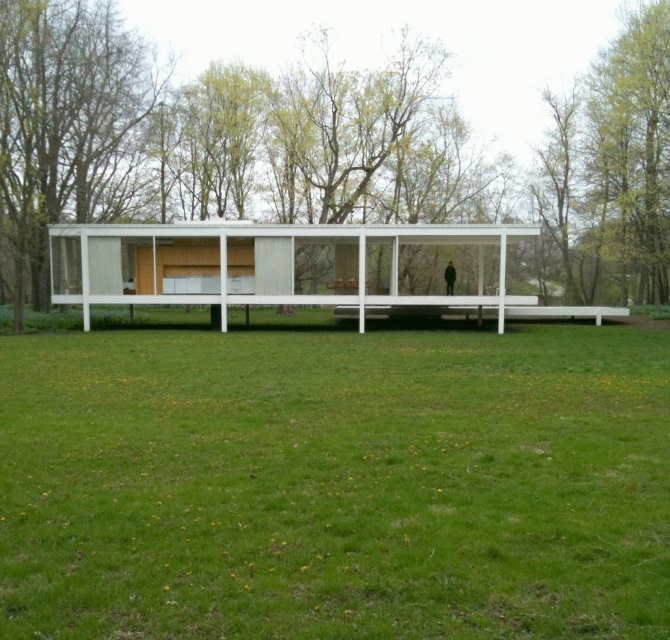
Question: Which of the following is the farthest from the observer?

Choices:
 (A) green leafy tree at center
 (B) green leafy tree at left

Answer: (B)

Question: Is green grass at lower center smaller than green leafy tree at left?

Choices:
 (A) no
 (B) yes

Answer: (B)

Question: Which of the following is the closest to the observer?

Choices:
 (A) (304, 464)
 (B) (31, 161)

Answer: (A)

Question: Does green leafy tree at center have a lesser width compared to green leafy tree at left?

Choices:
 (A) yes
 (B) no

Answer: (B)

Question: Among these points, which one is farthest from the camera?

Choices:
 (A) (0, 148)
 (B) (90, 202)

Answer: (B)

Question: Does green grass at lower center have a lesser width compared to green leafy tree at center?

Choices:
 (A) no
 (B) yes

Answer: (B)